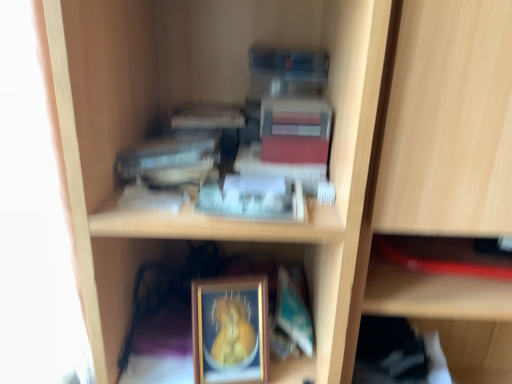
Question: Can you see hardcover book at upper center, which is the second paperback book from top to bottom, touching gold-framed picture at lower center?

Choices:
 (A) yes
 (B) no

Answer: (B)

Question: From a real-world perspective, is hardcover book at upper center, marked as the third paperback book in a right-to-left arrangement, on gold-framed picture at lower center?

Choices:
 (A) yes
 (B) no

Answer: (A)

Question: Can you confirm if hardcover book at upper center, which is the second paperback book in bottom-to-top order, is bigger than gold-framed picture at lower center?

Choices:
 (A) no
 (B) yes

Answer: (A)

Question: Considering the relative positions of hardcover book at upper center, which is the second paperback book in bottom-to-top order, and gold-framed picture at lower center in the image provided, is hardcover book at upper center, which is the second paperback book in bottom-to-top order, in front of gold-framed picture at lower center?

Choices:
 (A) no
 (B) yes

Answer: (B)

Question: Is gold-framed picture at lower center completely or partially inside hardcover book at upper center, marked as the third paperback book in a right-to-left arrangement?

Choices:
 (A) no
 (B) yes

Answer: (A)

Question: Relative to gold-framed picture at lower center, is teal matte paperback book at lower center, marked as the third paperback book in a left-to-right arrangement, in front or behind?

Choices:
 (A) front
 (B) behind

Answer: (B)

Question: Is teal matte paperback book at lower center, which is counted as the 3th paperback book, starting from the top, inside or outside of gold-framed picture at lower center?

Choices:
 (A) outside
 (B) inside

Answer: (A)

Question: Would you say teal matte paperback book at lower center, marked as the third paperback book in a left-to-right arrangement, is to the left or to the right of gold-framed picture at lower center in the picture?

Choices:
 (A) right
 (B) left

Answer: (A)

Question: From a real-world perspective, relative to gold-framed picture at lower center, is teal matte paperback book at lower center, which appears as the first paperback book when ordered from the bottom, vertically above or below?

Choices:
 (A) below
 (B) above

Answer: (A)

Question: Relative to teal matte paperback book at lower center, the 1th paperback book in the right-to-left sequence, is matte red paperback book at upper center, arranged as the 3th paperback book when ordered from the bottom, in front or behind?

Choices:
 (A) behind
 (B) front

Answer: (B)

Question: Considering the relative positions of matte red paperback book at upper center, arranged as the 3th paperback book when ordered from the bottom, and teal matte paperback book at lower center, marked as the third paperback book in a left-to-right arrangement, in the image provided, is matte red paperback book at upper center, arranged as the 3th paperback book when ordered from the bottom, to the left or to the right of teal matte paperback book at lower center, marked as the third paperback book in a left-to-right arrangement,?

Choices:
 (A) right
 (B) left

Answer: (B)

Question: Is matte red paperback book at upper center, marked as the second paperback book in a left-to-right arrangement, taller or shorter than teal matte paperback book at lower center, which appears as the first paperback book when ordered from the bottom?

Choices:
 (A) short
 (B) tall

Answer: (A)

Question: Does point (297, 117) appear closer or farther from the camera than point (274, 321)?

Choices:
 (A) closer
 (B) farther

Answer: (A)

Question: In terms of width, does gold-framed picture at lower center look wider or thinner when compared to matte red paperback book at upper center, arranged as the 3th paperback book when ordered from the bottom?

Choices:
 (A) wide
 (B) thin

Answer: (B)

Question: Based on their positions, is gold-framed picture at lower center located to the left or right of matte red paperback book at upper center, marked as the second paperback book in a left-to-right arrangement?

Choices:
 (A) right
 (B) left

Answer: (B)